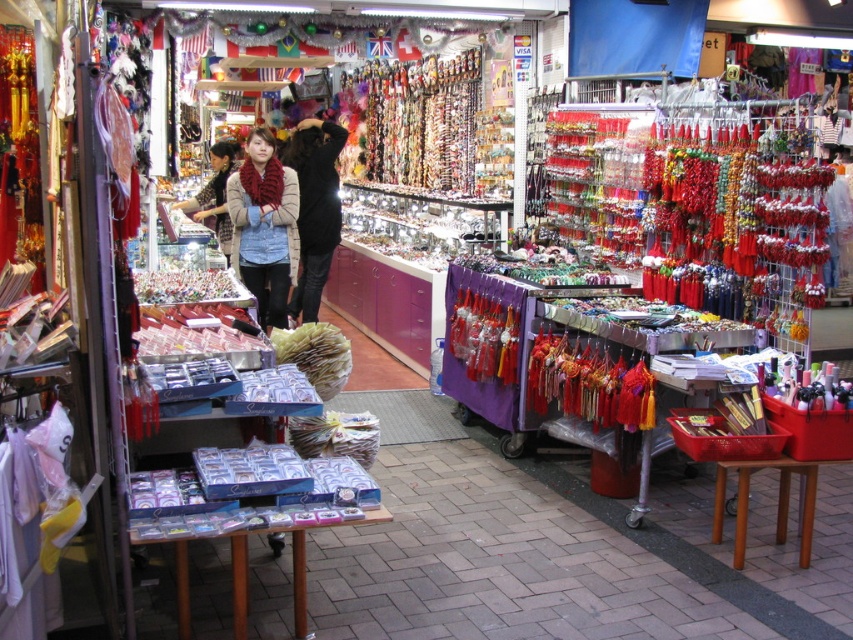
Question: In this image, where is knitted red scarf at center located relative to velvet scarf at center?

Choices:
 (A) right
 (B) left

Answer: (A)

Question: Considering the relative positions of knitted red scarf at center and black matte jacket at center in the image provided, where is knitted red scarf at center located with respect to black matte jacket at center?

Choices:
 (A) left
 (B) right

Answer: (A)

Question: Which object is the farthest from the black matte jacket at center?

Choices:
 (A) velvet scarf at center
 (B) knitted red scarf at center

Answer: (A)

Question: Can you confirm if black matte jacket at center is smaller than velvet scarf at center?

Choices:
 (A) yes
 (B) no

Answer: (A)

Question: Which of these objects is positioned farthest from the knitted red scarf at center?

Choices:
 (A) black matte jacket at center
 (B) velvet scarf at center

Answer: (B)

Question: Which of these objects is positioned farthest from the velvet scarf at center?

Choices:
 (A) black matte jacket at center
 (B) knitted red scarf at center

Answer: (A)